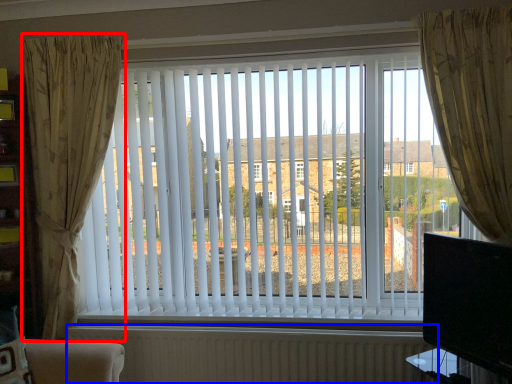
Question: Among these objects, which one is nearest to the camera, curtain (highlighted by a red box) or radiator (highlighted by a blue box)?

Choices:
 (A) curtain
 (B) radiator

Answer: (A)